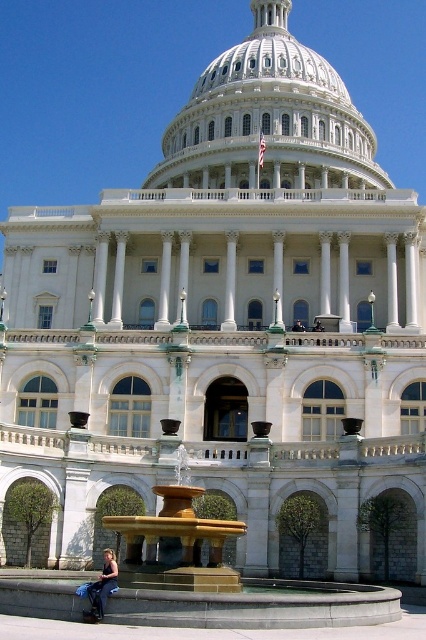
Question: Where is denim jacket at lower left located in relation to dark blue uniform at center in the image?

Choices:
 (A) right
 (B) left

Answer: (B)

Question: Is denim jacket at lower left below dark blue uniform at center?

Choices:
 (A) yes
 (B) no

Answer: (A)

Question: Which point is closer to the camera?

Choices:
 (A) white marble dome at upper center
 (B) denim jacket at lower left
 (C) dark blue uniform at center

Answer: (B)

Question: Can you confirm if white marble dome at upper center is bigger than white marble column at center?

Choices:
 (A) yes
 (B) no

Answer: (A)

Question: Considering the real-world distances, which object is closest to the dark blue uniform at center?

Choices:
 (A) denim jacket at lower left
 (B) white marble dome at upper center
 (C) white marble column at center

Answer: (C)

Question: Which point is farther from the camera taking this photo?

Choices:
 (A) (345, 163)
 (B) (279, 280)

Answer: (A)